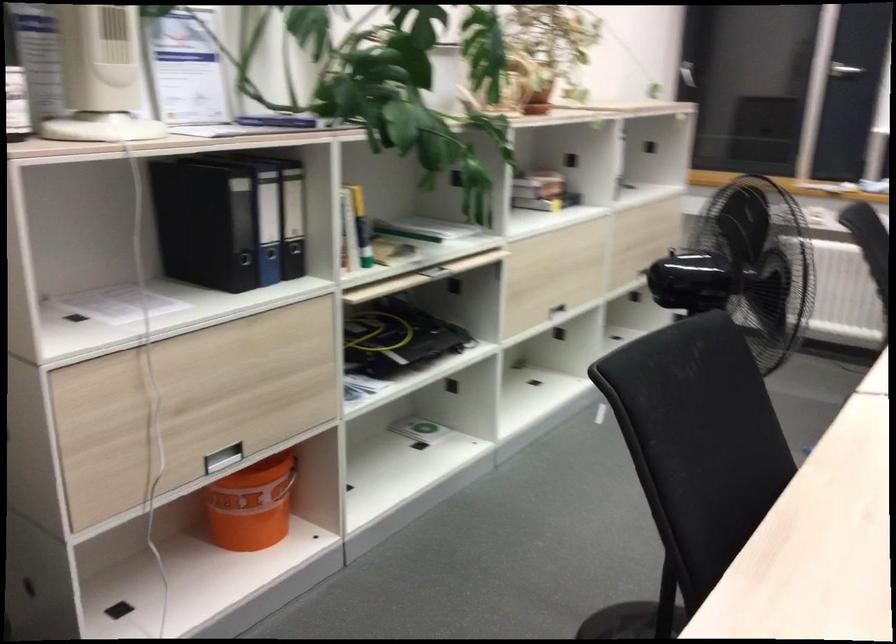
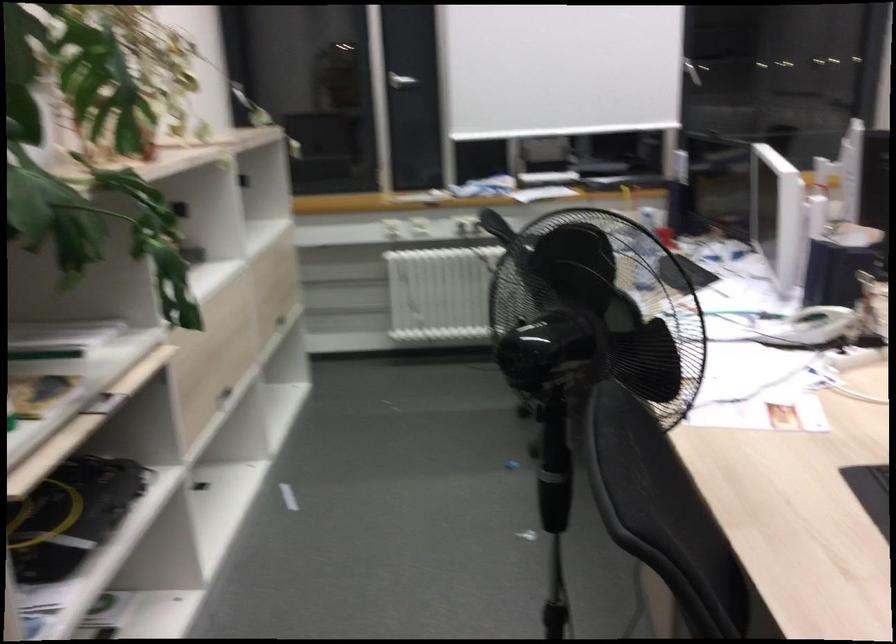
The point at (x=532, y=301) is marked in the first image. Where is the corresponding point in the second image?

(211, 395)